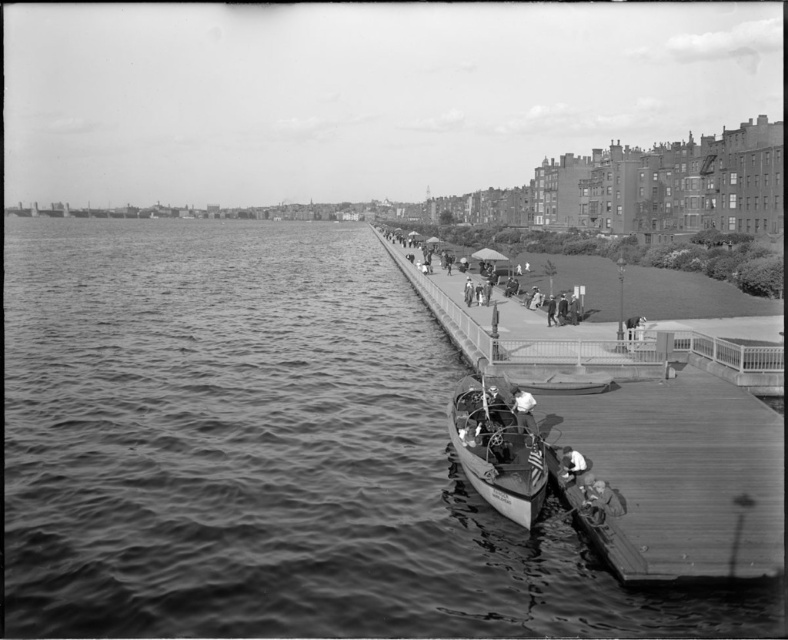
Can you confirm if wooden dock at lower right is taller than white fabric shirt at lower right?

Yes.

Between wooden dock at lower right and white fabric shirt at lower right, which one is positioned higher?

wooden dock at lower right

Image resolution: width=788 pixels, height=640 pixels. What do you see at coordinates (677, 474) in the screenshot?
I see `wooden dock at lower right` at bounding box center [677, 474].

Find the location of a particular element. wooden dock at lower right is located at coordinates (677, 474).

Consider the image. Can you confirm if white fabric shirt at lower right is wider than smooth skin person at center?

Correct, the width of white fabric shirt at lower right exceeds that of smooth skin person at center.

Is point (575, 468) farther from camera compared to point (528, 403)?

No, (575, 468) is closer to viewer.

Find the location of a particular element. This screenshot has width=788, height=640. white fabric shirt at lower right is located at coordinates (571, 464).

Does wooden dock at lower right have a greater height compared to wooden boat at lower center?

Indeed, wooden dock at lower right has a greater height compared to wooden boat at lower center.

The height and width of the screenshot is (640, 788). In order to click on wooden dock at lower right in this screenshot , I will do `click(677, 474)`.

Where is `wooden dock at lower right`? The width and height of the screenshot is (788, 640). wooden dock at lower right is located at coordinates (677, 474).